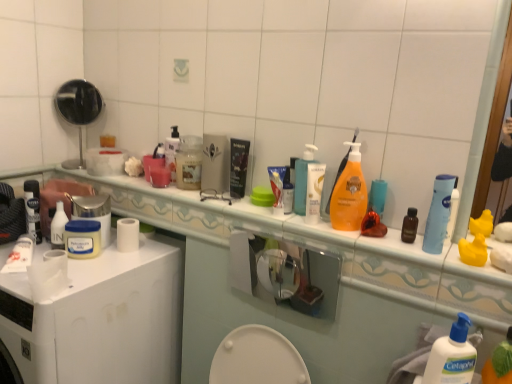
Find the location of `free space to the left of translucent plastic tube at center, the 2th toiletry viewed from the left`. free space to the left of translucent plastic tube at center, the 2th toiletry viewed from the left is located at coordinates (242, 210).